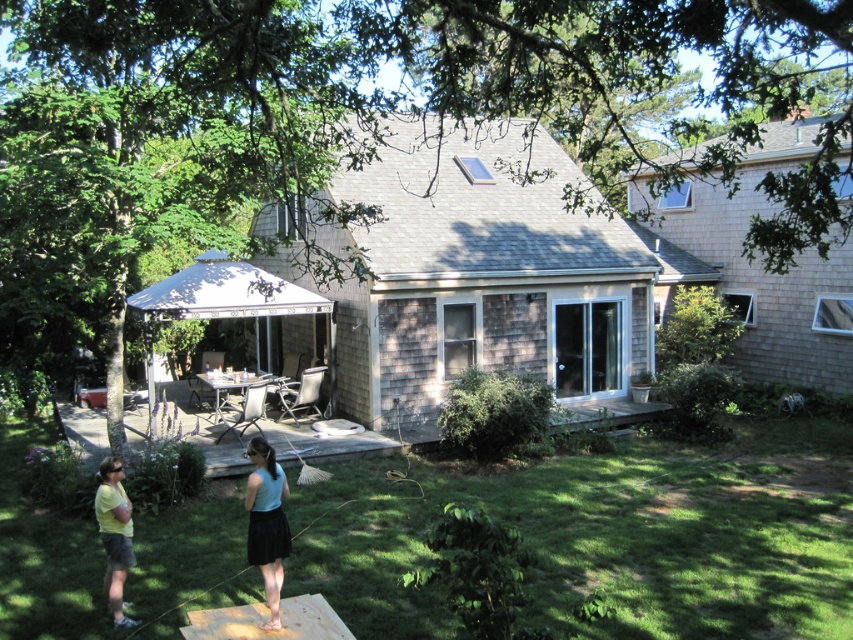
You are planning to place a small potted plant on the ground in the backyard. You see the green grass at lower center and the light blue fabric skirt at lower center. Where should you place the plant to ensure it is on the ground and not under the fabric skirt?

You should place the small potted plant on the green grass at lower center because it is located below the light blue fabric skirt at lower center, meaning the grass is on the ground while the fabric skirt is above it.

Looking at this image, you are planning to place a 2.5 meter long garden bench between the wooden deck at center and the light blue fabric skirt at lower center. Based on the distance between them, will there be enough space to place the bench without it overlapping either object?

The wooden deck at center and light blue fabric skirt at lower center are 7.13 meters apart. Since the bench is only 2.5 meters long, there is sufficient space between them to place the bench without overlapping either object.